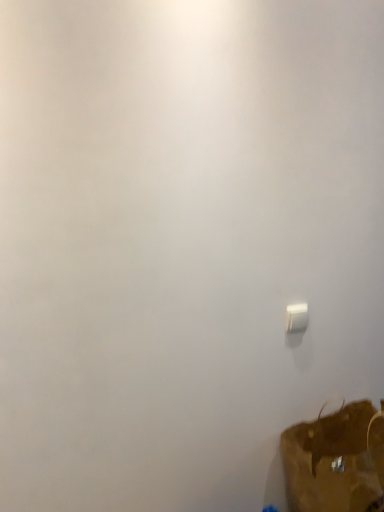
Question: Is point (377, 506) positioned closer to the camera than point (289, 306)?

Choices:
 (A) farther
 (B) closer

Answer: (B)

Question: From their relative heights in the image, would you say brown fabric luggage at lower right is taller or shorter than white plastic light switch at lower right?

Choices:
 (A) short
 (B) tall

Answer: (B)

Question: Based on their positions, is brown fabric luggage at lower right located to the left or right of white plastic light switch at lower right?

Choices:
 (A) right
 (B) left

Answer: (A)

Question: Considering the positions of point (294, 325) and point (364, 417), is point (294, 325) closer or farther from the camera than point (364, 417)?

Choices:
 (A) closer
 (B) farther

Answer: (A)

Question: Is white plastic light switch at lower right in front of or behind brown fabric luggage at lower right in the image?

Choices:
 (A) front
 (B) behind

Answer: (B)

Question: In terms of size, does white plastic light switch at lower right appear bigger or smaller than brown fabric luggage at lower right?

Choices:
 (A) big
 (B) small

Answer: (B)

Question: Is white plastic light switch at lower right wider or thinner than brown fabric luggage at lower right?

Choices:
 (A) thin
 (B) wide

Answer: (A)